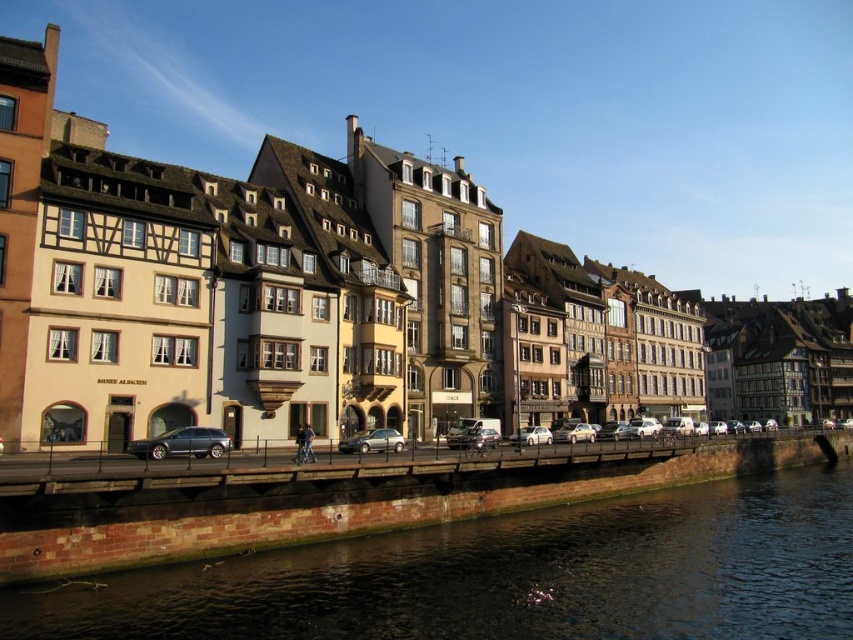
Between silver metallic car at center and white matte car at center, which one has more height?

With more height is white matte car at center.

Looking at this image, is silver metallic car at center shorter than white matte car at center?

Correct, silver metallic car at center is not as tall as white matte car at center.

Where is `silver metallic car at center`? silver metallic car at center is located at coordinates (372, 442).

Based on the photo, is dark brown stone river at lower center closer to camera compared to metallic silver car at center?

Yes, dark brown stone river at lower center is closer to the viewer.

Based on the photo, how much distance is there between dark brown stone river at lower center and metallic silver car at center?

A distance of 24.46 meters exists between dark brown stone river at lower center and metallic silver car at center.

Is point (694, 545) farther from camera compared to point (473, 442)?

No, it is in front of (473, 442).

Identify the location of dark brown stone river at lower center. Image resolution: width=853 pixels, height=640 pixels. (508, 577).

Does metallic gray station wagon at center appear on the right side of white matte car at center?

In fact, metallic gray station wagon at center is to the left of white matte car at center.

Which of these two, metallic gray station wagon at center or white matte car at center, stands taller?

Standing taller between the two is white matte car at center.

Identify the location of metallic gray station wagon at center. The height and width of the screenshot is (640, 853). (183, 444).

Where is `metallic gray station wagon at center`? The height and width of the screenshot is (640, 853). metallic gray station wagon at center is located at coordinates (183, 444).